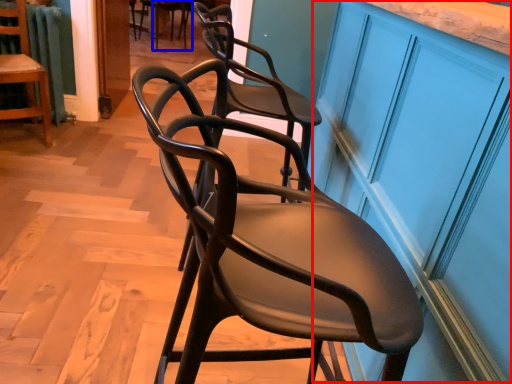
Question: Which point is closer to the camera, cabinetry (highlighted by a red box) or chair (highlighted by a blue box)?

Choices:
 (A) cabinetry
 (B) chair

Answer: (A)